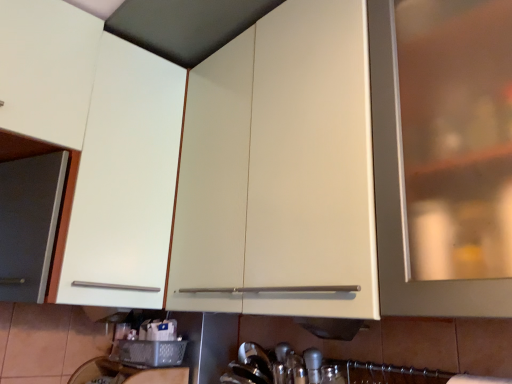
You are a GUI agent. You are given a task and a screenshot of the screen. Output one action in this format:
    pyautogui.click(x=<x>, y=<y>)
    Task: Click on the matte white cabinet at center, the 1th cabinetry positioned from the right
    
    Given the screenshot: What is the action you would take?
    pyautogui.click(x=280, y=171)

What is the approximate height of matte white cabinet at center, the 1th cabinetry positioned from the right?

matte white cabinet at center, the 1th cabinetry positioned from the right, is 35.49 inches in height.

In order to face matte white cabinet at center, which is the second cabinetry in left-to-right order, should I rotate leftwards or rightwards?

Turn right by 4.146 degrees to look at matte white cabinet at center, which is the second cabinetry in left-to-right order.

Describe the element at coordinates (280, 171) in the screenshot. This screenshot has height=384, width=512. I see `matte white cabinet at center, which is the second cabinetry in left-to-right order` at that location.

What do you see at coordinates (97, 146) in the screenshot? I see `matte white cabinet at left, the 1th cabinetry positioned from the left` at bounding box center [97, 146].

Locate an element on the screen. This screenshot has width=512, height=384. matte white cabinet at left, the 1th cabinetry positioned from the left is located at coordinates (97, 146).

Where is `matte white cabinet at center, the 1th cabinetry positioned from the right`? The image size is (512, 384). matte white cabinet at center, the 1th cabinetry positioned from the right is located at coordinates (280, 171).

Considering the positions of objects matte white cabinet at center, the 1th cabinetry positioned from the right, and matte white cabinet at left, the 1th cabinetry positioned from the left, in the image provided, who is more to the right, matte white cabinet at center, the 1th cabinetry positioned from the right, or matte white cabinet at left, the 1th cabinetry positioned from the left,?

A: From the viewer's perspective, matte white cabinet at center, the 1th cabinetry positioned from the right, appears more on the right side.

Considering the positions of objects matte white cabinet at center, which is the second cabinetry in left-to-right order, and matte white cabinet at left, the 2th cabinetry positioned from the right, in the image provided, who is behind, matte white cabinet at center, which is the second cabinetry in left-to-right order, or matte white cabinet at left, the 2th cabinetry positioned from the right,?

matte white cabinet at left, the 2th cabinetry positioned from the right, is behind.

Between point (313, 79) and point (75, 139), which one is positioned in front?

The point (313, 79) is more forward.

From the image's perspective, would you say matte white cabinet at center, which is the second cabinetry in left-to-right order, is shown under matte white cabinet at left, the 1th cabinetry positioned from the left?

Actually, matte white cabinet at center, which is the second cabinetry in left-to-right order, appears above matte white cabinet at left, the 1th cabinetry positioned from the left, in the image.

From a real-world perspective, who is located lower, matte white cabinet at center, which is the second cabinetry in left-to-right order, or matte white cabinet at left, the 2th cabinetry positioned from the right?

matte white cabinet at center, which is the second cabinetry in left-to-right order, is physically lower.

Which of these two, matte white cabinet at center, which is the second cabinetry in left-to-right order, or matte white cabinet at left, the 2th cabinetry positioned from the right, is wider?

matte white cabinet at left, the 2th cabinetry positioned from the right, is wider.

Is matte white cabinet at center, the 1th cabinetry positioned from the right, taller than matte white cabinet at left, the 1th cabinetry positioned from the left?

No, matte white cabinet at center, the 1th cabinetry positioned from the right, is not taller than matte white cabinet at left, the 1th cabinetry positioned from the left.

Between matte white cabinet at center, which is the second cabinetry in left-to-right order, and matte white cabinet at left, the 1th cabinetry positioned from the left, which one has smaller size?

With smaller size is matte white cabinet at left, the 1th cabinetry positioned from the left.

Would you say matte white cabinet at left, the 1th cabinetry positioned from the left, is part of matte white cabinet at center, the 1th cabinetry positioned from the right,'s contents?

No, matte white cabinet at left, the 1th cabinetry positioned from the left, is located outside of matte white cabinet at center, the 1th cabinetry positioned from the right.

Are matte white cabinet at center, the 1th cabinetry positioned from the right, and matte white cabinet at left, the 2th cabinetry positioned from the right, making contact?

No, matte white cabinet at center, the 1th cabinetry positioned from the right, is not in contact with matte white cabinet at left, the 2th cabinetry positioned from the right.

Is matte white cabinet at center, the 1th cabinetry positioned from the right, oriented towards matte white cabinet at left, the 1th cabinetry positioned from the left?

No, matte white cabinet at center, the 1th cabinetry positioned from the right, is not oriented towards matte white cabinet at left, the 1th cabinetry positioned from the left.

What's the angular difference between matte white cabinet at center, the 1th cabinetry positioned from the right, and matte white cabinet at left, the 1th cabinetry positioned from the left,'s facing directions?

87.2 degrees.

Where is `cabinetry below the matte white cabinet at center, the 1th cabinetry positioned from the right (from the image's perspective)`? The height and width of the screenshot is (384, 512). cabinetry below the matte white cabinet at center, the 1th cabinetry positioned from the right (from the image's perspective) is located at coordinates (97, 146).

Between matte white cabinet at left, the 2th cabinetry positioned from the right, and matte white cabinet at center, which is the second cabinetry in left-to-right order, which one appears on the left side from the viewer's perspective?

From the viewer's perspective, matte white cabinet at left, the 2th cabinetry positioned from the right, appears more on the left side.

Considering the relative positions of matte white cabinet at left, the 2th cabinetry positioned from the right, and matte white cabinet at center, the 1th cabinetry positioned from the right, in the image provided, is matte white cabinet at left, the 2th cabinetry positioned from the right, in front of matte white cabinet at center, the 1th cabinetry positioned from the right,?

That is False.

Is point (13, 13) farther from viewer compared to point (209, 297)?

Yes, it is behind point (209, 297).

Looking at this image, from the image's perspective, who appears lower, matte white cabinet at left, the 1th cabinetry positioned from the left, or matte white cabinet at center, the 1th cabinetry positioned from the right?

matte white cabinet at left, the 1th cabinetry positioned from the left, appears lower in the image.

From a real-world perspective, is matte white cabinet at left, the 2th cabinetry positioned from the right, below matte white cabinet at center, which is the second cabinetry in left-to-right order?

No, from a real-world perspective, matte white cabinet at left, the 2th cabinetry positioned from the right, is not below matte white cabinet at center, which is the second cabinetry in left-to-right order.

Between matte white cabinet at left, the 2th cabinetry positioned from the right, and matte white cabinet at center, the 1th cabinetry positioned from the right, which one has smaller width?

matte white cabinet at center, the 1th cabinetry positioned from the right.

Who is taller, matte white cabinet at left, the 1th cabinetry positioned from the left, or matte white cabinet at center, the 1th cabinetry positioned from the right?

Standing taller between the two is matte white cabinet at left, the 1th cabinetry positioned from the left.

Between matte white cabinet at left, the 2th cabinetry positioned from the right, and matte white cabinet at center, which is the second cabinetry in left-to-right order, which one has larger size?

Bigger between the two is matte white cabinet at center, which is the second cabinetry in left-to-right order.

Is matte white cabinet at left, the 1th cabinetry positioned from the left, inside or outside of matte white cabinet at center, which is the second cabinetry in left-to-right order?

matte white cabinet at left, the 1th cabinetry positioned from the left, is not inside matte white cabinet at center, which is the second cabinetry in left-to-right order, it's outside.

Is matte white cabinet at left, the 1th cabinetry positioned from the left, touching matte white cabinet at center, which is the second cabinetry in left-to-right order?

No.

Is matte white cabinet at left, the 1th cabinetry positioned from the left, positioned with its back to matte white cabinet at center, which is the second cabinetry in left-to-right order?

That's not correct — matte white cabinet at left, the 1th cabinetry positioned from the left, is not looking away from matte white cabinet at center, which is the second cabinetry in left-to-right order.

The image size is (512, 384). I want to click on cabinetry above the matte white cabinet at left, the 2th cabinetry positioned from the right (from the image's perspective), so (280, 171).

Where is `cabinetry on the left side of matte white cabinet at center, which is the second cabinetry in left-to-right order`? cabinetry on the left side of matte white cabinet at center, which is the second cabinetry in left-to-right order is located at coordinates (97, 146).

This screenshot has height=384, width=512. Find the location of `cabinetry lying above the matte white cabinet at left, the 2th cabinetry positioned from the right (from the image's perspective)`. cabinetry lying above the matte white cabinet at left, the 2th cabinetry positioned from the right (from the image's perspective) is located at coordinates (280, 171).